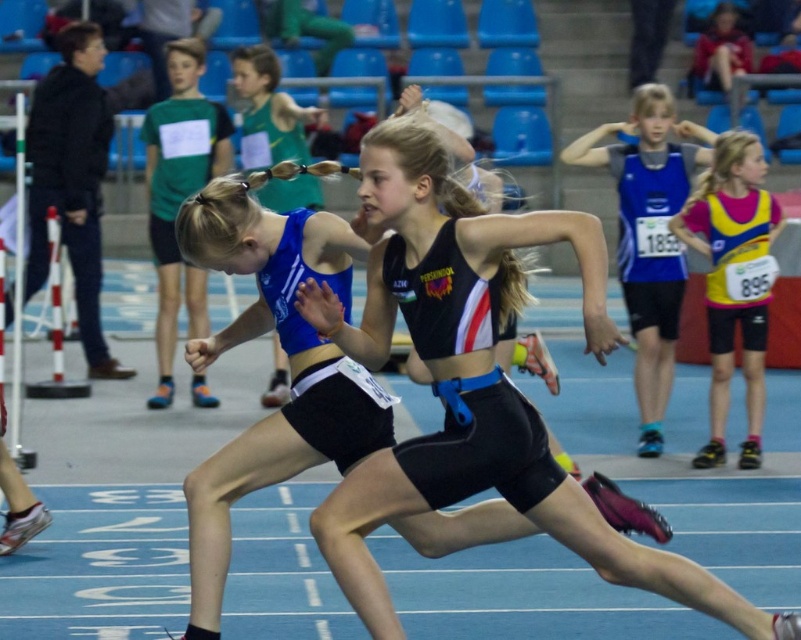
Question: Which object appears farthest from the camera in this image?

Choices:
 (A) yellow and pink jersey at right
 (B) matte black shorts at left
 (C) blue jersey at center
 (D) black matte running suit at center

Answer: (B)

Question: Where is blue jersey at center located in relation to matte black shorts at left in the image?

Choices:
 (A) right
 (B) left

Answer: (A)

Question: Is blue jersey at center closer to camera compared to yellow and pink jersey at right?

Choices:
 (A) no
 (B) yes

Answer: (A)

Question: Among these points, which one is nearest to the camera?

Choices:
 (A) (707, 154)
 (B) (341, 497)
 (C) (87, 323)
 (D) (723, 404)

Answer: (B)

Question: Does black matte running suit at center appear under yellow and pink jersey at right?

Choices:
 (A) yes
 (B) no

Answer: (A)

Question: Which object appears closest to the camera in this image?

Choices:
 (A) blue jersey at center
 (B) matte black shorts at left
 (C) yellow and pink jersey at right
 (D) black matte running suit at center

Answer: (D)